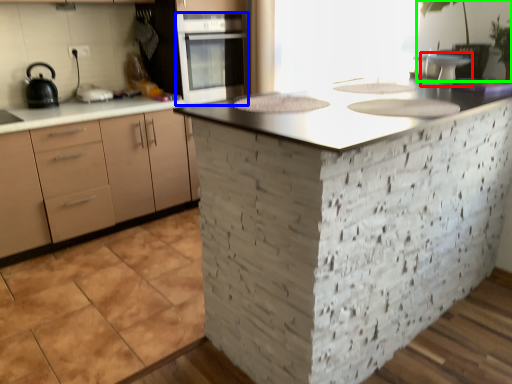
Question: Which is nearer to the appliance (highlighted by a red box)? oven (highlighted by a blue box) or plant (highlighted by a green box).

Choices:
 (A) oven
 (B) plant

Answer: (B)